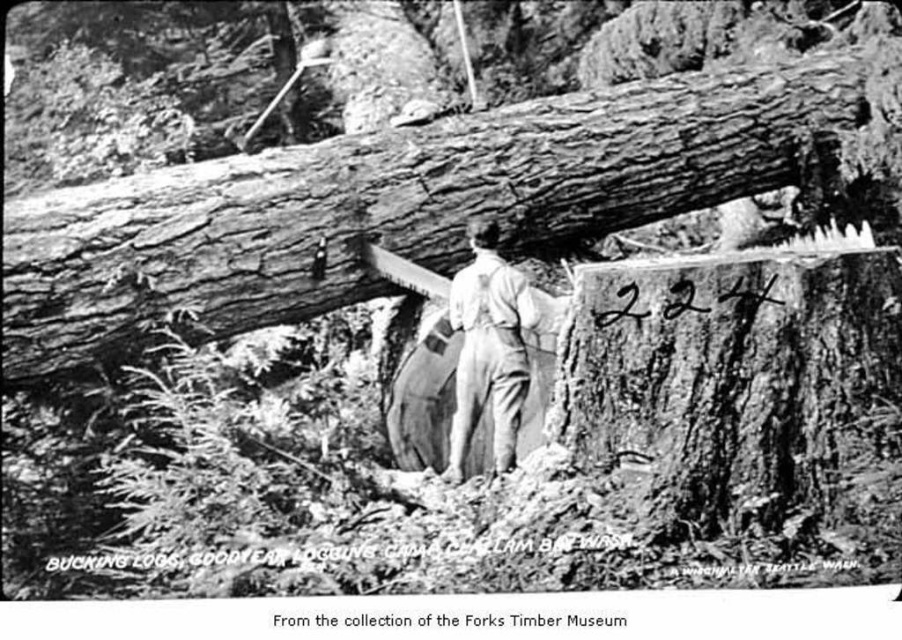
Question: Is rough bark log at center to the right of light gray overalls at center from the viewer's perspective?

Choices:
 (A) yes
 (B) no

Answer: (B)

Question: Which object is farther from the camera taking this photo?

Choices:
 (A) light gray overalls at center
 (B) rough bark log at center

Answer: (B)

Question: Which of the following is the closest to the observer?

Choices:
 (A) light gray overalls at center
 (B) rough bark log at center

Answer: (A)

Question: Which of the following is the farthest from the observer?

Choices:
 (A) (726, 177)
 (B) (477, 388)

Answer: (A)

Question: In this image, where is rough bark log at center located relative to light gray overalls at center?

Choices:
 (A) below
 (B) above

Answer: (B)

Question: Can you confirm if rough bark log at center is bigger than light gray overalls at center?

Choices:
 (A) yes
 (B) no

Answer: (A)